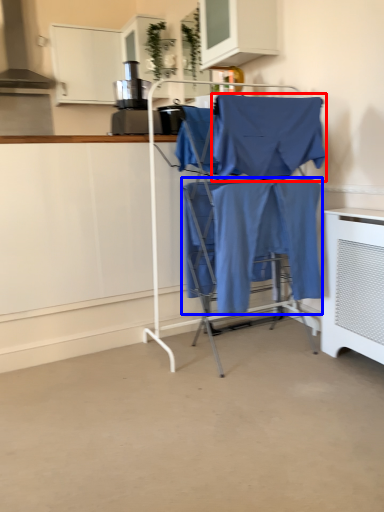
Question: Which point is closer to the camera, fabric (highlighted by a red box) or fabric (highlighted by a blue box)?

Choices:
 (A) fabric
 (B) fabric

Answer: (A)